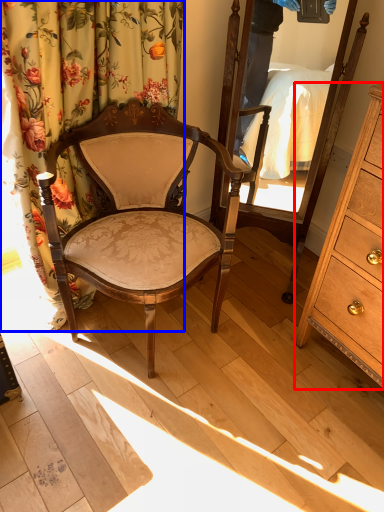
Question: Which object appears closest to the camera in this image, cabinetry (highlighted by a red box) or curtain (highlighted by a blue box)?

Choices:
 (A) cabinetry
 (B) curtain

Answer: (A)